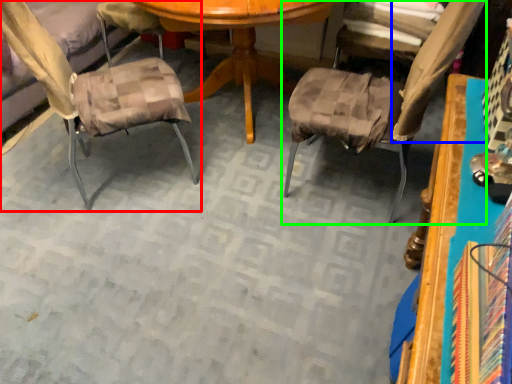
Question: Based on their relative distances, which object is farther from chair (highlighted by a red box)? Choose from fabric (highlighted by a blue box) and chair (highlighted by a green box).

Choices:
 (A) fabric
 (B) chair

Answer: (A)